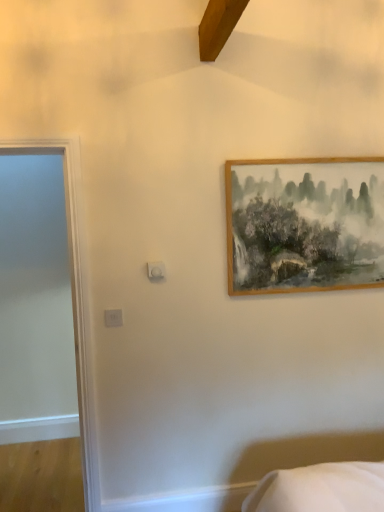
What do you see at coordinates (75, 300) in the screenshot? The width and height of the screenshot is (384, 512). I see `white glossy door at left` at bounding box center [75, 300].

The height and width of the screenshot is (512, 384). In order to click on white glossy door at left in this screenshot , I will do `click(75, 300)`.

This screenshot has height=512, width=384. Describe the element at coordinates (304, 224) in the screenshot. I see `wooden frame at upper right` at that location.

You are a GUI agent. You are given a task and a screenshot of the screen. Output one action in this format:
    pyautogui.click(x=<x>, y=<y>)
    Task: Click on the wooden frame at upper right
    The image size is (384, 512).
    Given the screenshot: What is the action you would take?
    pyautogui.click(x=304, y=224)

Locate an element on the screen. The height and width of the screenshot is (512, 384). white glossy door at left is located at coordinates (75, 300).

Consider the image. Considering the positions of objects white glossy door at left and wooden frame at upper right in the image provided, who is more to the right, white glossy door at left or wooden frame at upper right?

Positioned to the right is wooden frame at upper right.

Is white glossy door at left closer to the viewer compared to wooden frame at upper right?

Yes, it is in front of wooden frame at upper right.

Does point (8, 146) come in front of point (279, 214)?

Yes.

From the image's perspective, does white glossy door at left appear higher than wooden frame at upper right?

No, from the image's perspective, white glossy door at left is not above wooden frame at upper right.

From a real-world perspective, is white glossy door at left located higher than wooden frame at upper right?

No, from a real-world perspective, white glossy door at left is not above wooden frame at upper right.

Considering the relative sizes of white glossy door at left and wooden frame at upper right in the image provided, is white glossy door at left thinner than wooden frame at upper right?

In fact, white glossy door at left might be wider than wooden frame at upper right.

Is white glossy door at left taller than wooden frame at upper right?

Yes.

Does white glossy door at left have a larger size compared to wooden frame at upper right?

Indeed, white glossy door at left has a larger size compared to wooden frame at upper right.

Would you say white glossy door at left is inside or outside wooden frame at upper right?

white glossy door at left is spatially situated outside wooden frame at upper right.

Are white glossy door at left and wooden frame at upper right beside each other?

No, white glossy door at left is not touching wooden frame at upper right.

Is white glossy door at left oriented away from wooden frame at upper right?

white glossy door at left is not turned away from wooden frame at upper right.

How many degrees apart are the facing directions of white glossy door at left and wooden frame at upper right?

They differ by 0.786 degrees in their facing directions.

At what (x,y) coordinates should I click in order to perform the action: click on door that appears below the wooden frame at upper right (from the image's perspective). Please return your answer as a coordinate pair (x, y). The width and height of the screenshot is (384, 512). Looking at the image, I should click on (75, 300).

Can you confirm if wooden frame at upper right is positioned to the right of white glossy door at left?

Yes.

Is the depth of wooden frame at upper right less than that of white glossy door at left?

That is False.

Considering the points (264, 270) and (77, 199), which point is in front, point (264, 270) or point (77, 199)?

The point (77, 199) is closer.

From the image's perspective, would you say wooden frame at upper right is positioned over white glossy door at left?

Yes.

From a real-world perspective, is wooden frame at upper right physically located above or below white glossy door at left?

wooden frame at upper right is above white glossy door at left.

Is wooden frame at upper right thinner than white glossy door at left?

Yes.

From the picture: Considering the sizes of objects wooden frame at upper right and white glossy door at left in the image provided, who is taller, wooden frame at upper right or white glossy door at left?

Standing taller between the two is white glossy door at left.

Considering the sizes of objects wooden frame at upper right and white glossy door at left in the image provided, who is bigger, wooden frame at upper right or white glossy door at left?

white glossy door at left is bigger.

Would you say wooden frame at upper right is inside or outside white glossy door at left?

wooden frame at upper right is not enclosed by white glossy door at left.

Is wooden frame at upper right in contact with white glossy door at left?

wooden frame at upper right and white glossy door at left are not in contact.

Is wooden frame at upper right turned away from white glossy door at left?

No, white glossy door at left is not at the back of wooden frame at upper right.

How far apart are wooden frame at upper right and white glossy door at left?

wooden frame at upper right and white glossy door at left are 1.13 meters apart from each other.

Image resolution: width=384 pixels, height=512 pixels. In order to click on picture frame behind the white glossy door at left in this screenshot , I will do `click(304, 224)`.

Locate an element on the screen. door below the wooden frame at upper right (from a real-world perspective) is located at coordinates (75, 300).

You are a GUI agent. You are given a task and a screenshot of the screen. Output one action in this format:
    pyautogui.click(x=<x>, y=<y>)
    Task: Click on the picture frame behind the white glossy door at left
    The height and width of the screenshot is (512, 384).
    Given the screenshot: What is the action you would take?
    pyautogui.click(x=304, y=224)